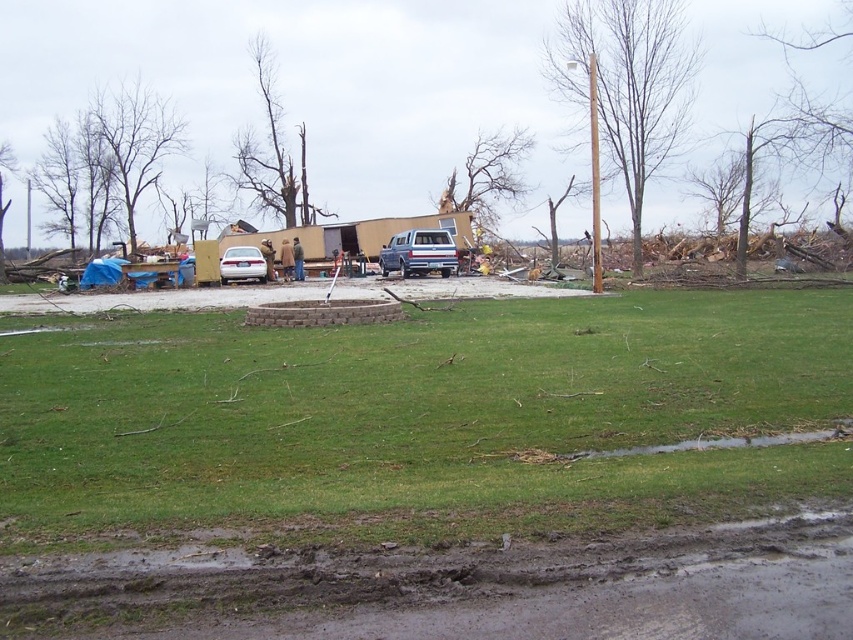
Is muddy dirt at lower center positioned at the back of silver metallic sedan at center?

No, it is in front of silver metallic sedan at center.

Does muddy dirt at lower center appear on the right side of silver metallic sedan at center?

Indeed, muddy dirt at lower center is positioned on the right side of silver metallic sedan at center.

Identify the location of muddy dirt at lower center. The height and width of the screenshot is (640, 853). (456, 589).

Which is behind, point (375, 396) or point (421, 240)?

Positioned behind is point (421, 240).

Describe the element at coordinates (426, 416) in the screenshot. The height and width of the screenshot is (640, 853). I see `green grass at center` at that location.

Who is more distant from viewer, (671, 440) or (384, 264)?

Point (384, 264)

I want to click on green grass at center, so click(426, 416).

Who is positioned more to the right, green grass at center or muddy dirt at lower center?

Positioned to the right is green grass at center.

From the picture: Is green grass at center further to camera compared to muddy dirt at lower center?

Yes, it is.

Locate an element on the screen. green grass at center is located at coordinates (426, 416).